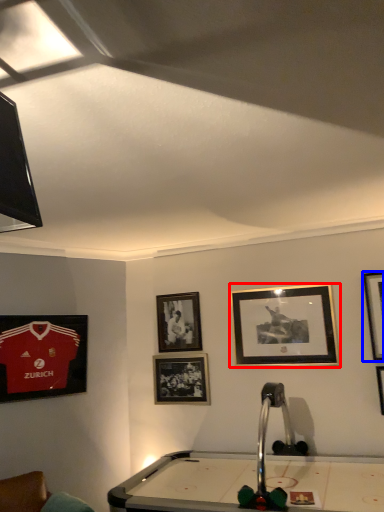
Question: Which point is further to the camera, picture frame (highlighted by a red box) or picture frame (highlighted by a blue box)?

Choices:
 (A) picture frame
 (B) picture frame

Answer: (A)